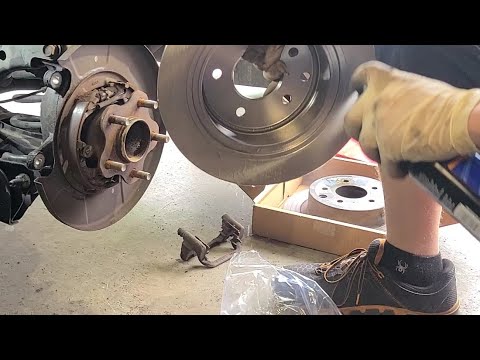
This screenshot has height=360, width=480. I want to click on sock, so click(408, 268).